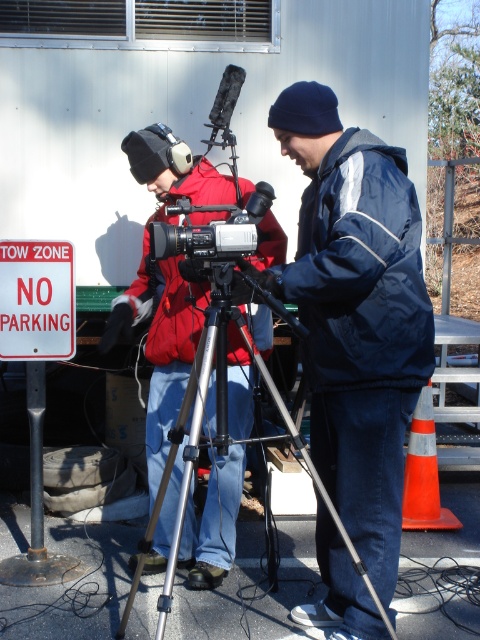
Which is more to the right, silver metallic tripod at center or white plastic sign at left?

silver metallic tripod at center is more to the right.

Who is positioned more to the left, silver metallic tripod at center or white plastic sign at left?

white plastic sign at left

Where is `silver metallic tripod at center`? The height and width of the screenshot is (640, 480). silver metallic tripod at center is located at coordinates (222, 442).

You are a GUI agent. You are given a task and a screenshot of the screen. Output one action in this format:
    pyautogui.click(x=<x>, y=<y>)
    Task: Click on the silver metallic tripod at center
    The height and width of the screenshot is (640, 480).
    Given the screenshot: What is the action you would take?
    pyautogui.click(x=222, y=442)

Is point (362, 636) positioned in front of point (172, 573)?

No, (362, 636) is behind (172, 573).

Is dark blue jacket at center positioned before silver metallic tripod at center?

That is False.

Is point (399, 512) farther from viewer compared to point (222, 317)?

That is True.

Where is `dark blue jacket at center`? dark blue jacket at center is located at coordinates (356, 314).

Does white plastic sign at left have a larger size compared to silver metallic video camera at center?

Actually, white plastic sign at left might be smaller than silver metallic video camera at center.

I want to click on white plastic sign at left, so click(36, 300).